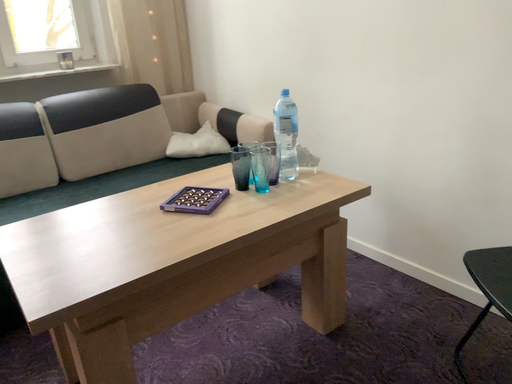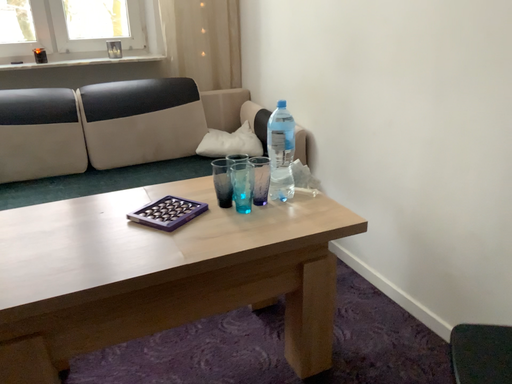
Question: How did the camera likely rotate when shooting the video?

Choices:
 (A) rotated right
 (B) rotated left

Answer: (B)